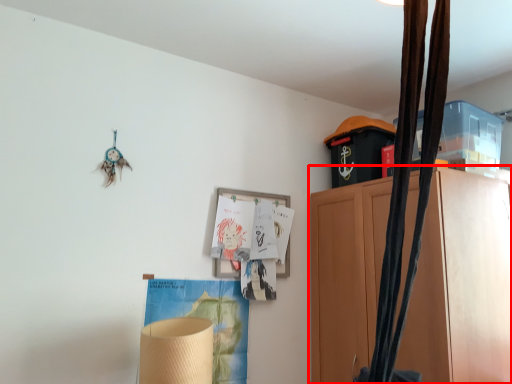
Question: From the image's perspective, what is the correct spatial relationship of cabinetry (annotated by the red box) in relation to picture frame?

Choices:
 (A) above
 (B) below

Answer: (B)